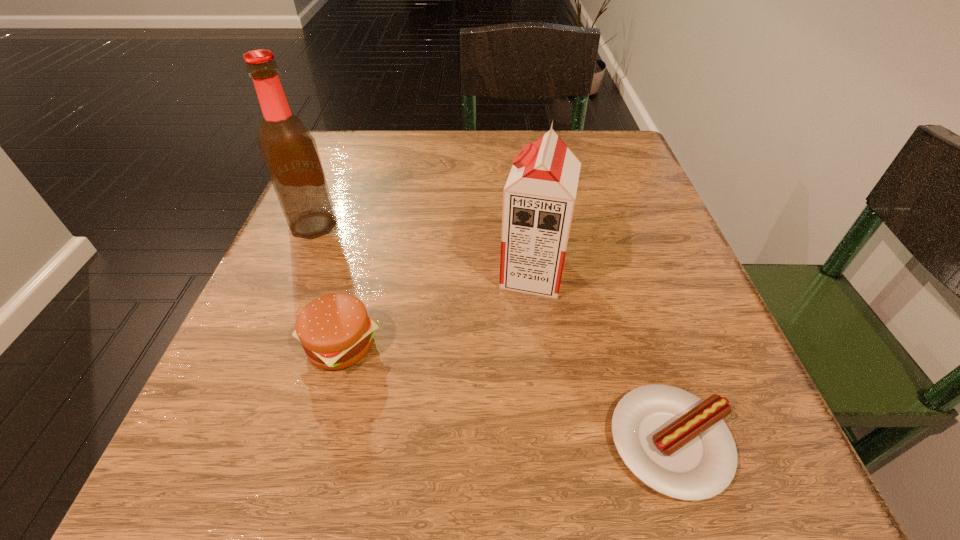
The image size is (960, 540). What are the coordinates of `unoccupied position between the hamburger and the beer bottle` in the screenshot? It's located at (327, 285).

The height and width of the screenshot is (540, 960). What are the coordinates of `free area in between the hamburger and the third object from left to right` in the screenshot? It's located at (437, 309).

Identify the location of free space between the third object from left to right and the sausage. The height and width of the screenshot is (540, 960). (602, 358).

The image size is (960, 540). I want to click on free space between the third shortest object and the second nearest object, so click(x=437, y=309).

At what (x,y) coordinates should I click in order to perform the action: click on the closest object relative to the beer bottle. Please return your answer as a coordinate pair (x, y). Looking at the image, I should click on (335, 331).

Select which object appears as the second closest to the third tallest object. Please provide its 2D coordinates. Your answer should be formatted as a tuple, i.e. [(x, y)], where the tuple contains the x and y coordinates of a point satisfying the conditions above.

[(538, 199)]

What are the coordinates of `vacant area that satisfies the following two spatial constraints: 1. on the front side of the third object from right to left; 2. on the right side of the farthest object` in the screenshot? It's located at (262, 345).

I want to click on vacant area in the image that satisfies the following two spatial constraints: 1. on the back side of the second tallest object; 2. on the right side of the third object from right to left, so click(x=360, y=274).

Locate an element on the screen. The image size is (960, 540). vacant space that satisfies the following two spatial constraints: 1. on the front side of the third shortest object; 2. on the right side of the shortest object is located at coordinates (553, 442).

Locate an element on the screen. vacant area in the image that satisfies the following two spatial constraints: 1. on the front side of the shortest object; 2. on the left side of the third tallest object is located at coordinates (314, 442).